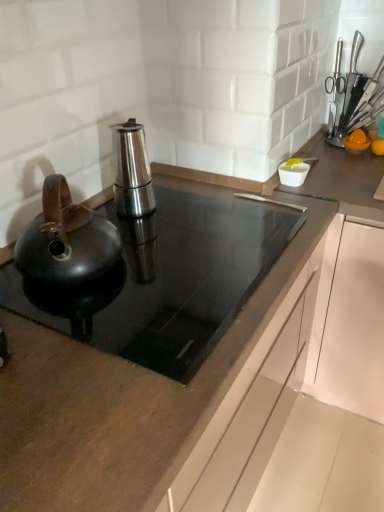
Question: Is metallic knife block at upper right wider or thinner than stainless steel espresso maker at center, which is the 1th kitchen appliance in back-to-front order?

Choices:
 (A) wide
 (B) thin

Answer: (B)

Question: Based on their positions, is metallic knife block at upper right located to the left or right of stainless steel espresso maker at center, positioned as the second kitchen appliance in front-to-back order?

Choices:
 (A) right
 (B) left

Answer: (A)

Question: Based on their relative distances, which object is nearer to the shiny black kettle at left, positioned as the second kitchen appliance in back-to-front order?

Choices:
 (A) metallic knife block at upper right
 (B) black glass cooktop at center
 (C) stainless steel espresso maker at center, positioned as the second kitchen appliance in front-to-back order

Answer: (B)

Question: Which of these objects is positioned farthest from the stainless steel espresso maker at center, which is the 1th kitchen appliance in back-to-front order?

Choices:
 (A) black glass cooktop at center
 (B) shiny black kettle at left, positioned as the second kitchen appliance in back-to-front order
 (C) metallic knife block at upper right

Answer: (C)